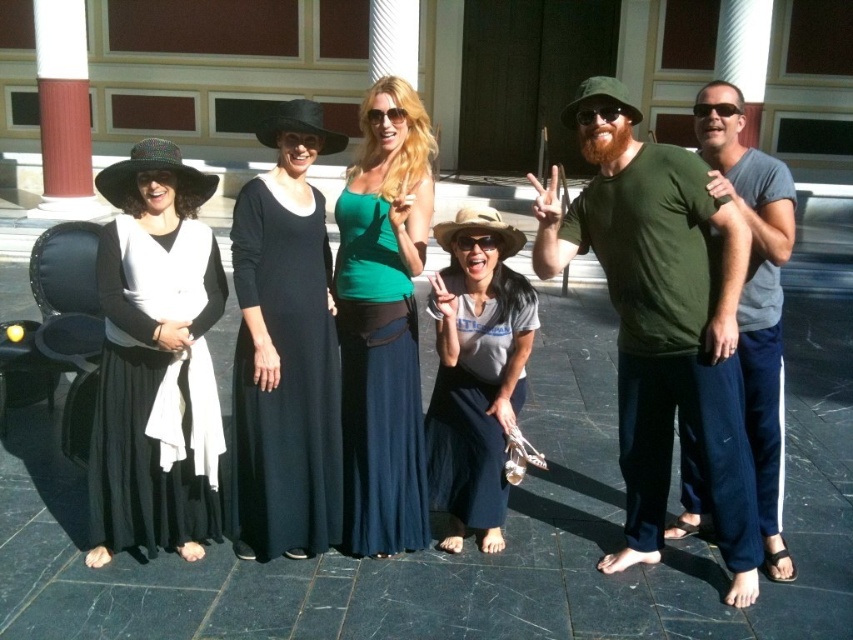
Is the position of green matte t-shirt at center more distant than that of green matte tank top at center?

No, green matte t-shirt at center is in front of green matte tank top at center.

Between green matte t-shirt at center and green matte tank top at center, which one is positioned lower?

green matte t-shirt at center is lower down.

Consider the image. Who is more distant from viewer, (746, 227) or (389, 221)?

Positioned behind is point (389, 221).

This screenshot has height=640, width=853. I want to click on green matte t-shirt at center, so click(660, 321).

Find the location of a particular element. The width and height of the screenshot is (853, 640). green matte t-shirt at center is located at coordinates (660, 321).

Consider the image. Who is shorter, green matte t-shirt at center or black cotton dress at center?

black cotton dress at center is shorter.

Image resolution: width=853 pixels, height=640 pixels. What do you see at coordinates (660, 321) in the screenshot? I see `green matte t-shirt at center` at bounding box center [660, 321].

Where is `green matte t-shirt at center`? This screenshot has width=853, height=640. green matte t-shirt at center is located at coordinates (660, 321).

Who is taller, green matte tank top at center or gray cotton t-shirt at center?

green matte tank top at center is taller.

Which is behind, point (366, 548) or point (457, 516)?

Positioned behind is point (457, 516).

What are the coordinates of `green matte tank top at center` in the screenshot? It's located at pos(383,323).